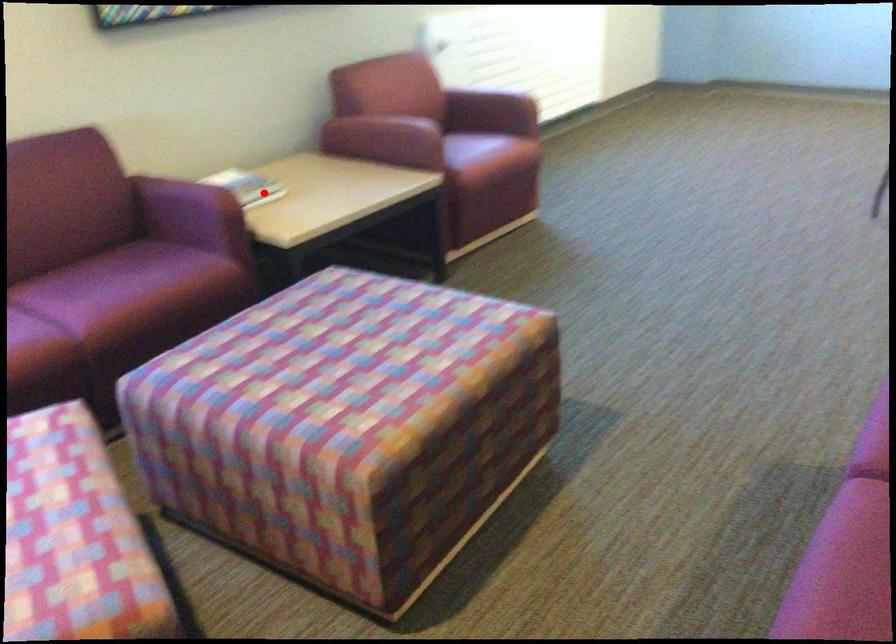
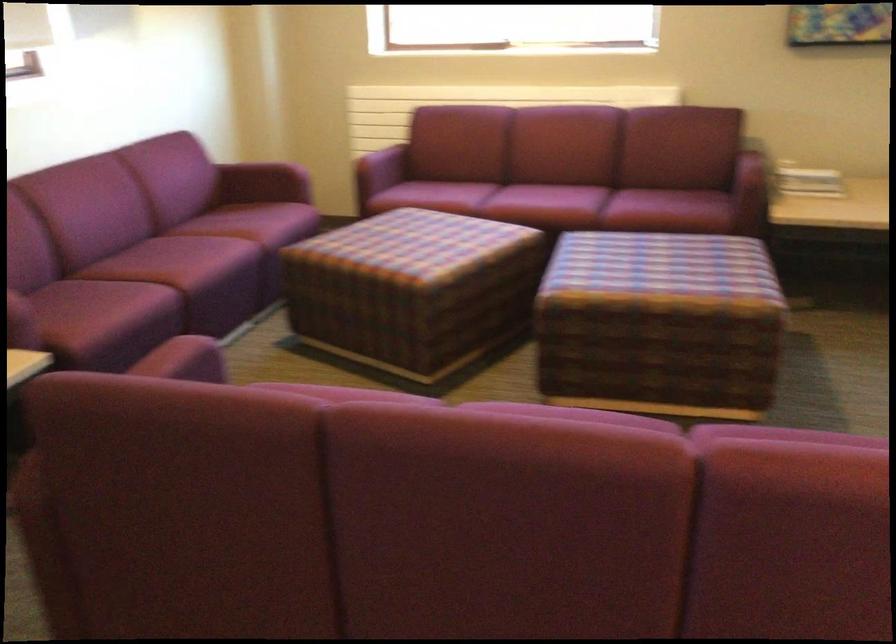
Question: I am providing you with two images of the same scene from different viewpoints. A red point is shown in image1. For the corresponding object point in image2, is it positioned nearer or farther from the camera?

Choices:
 (A) Nearer
 (B) Farther

Answer: (B)